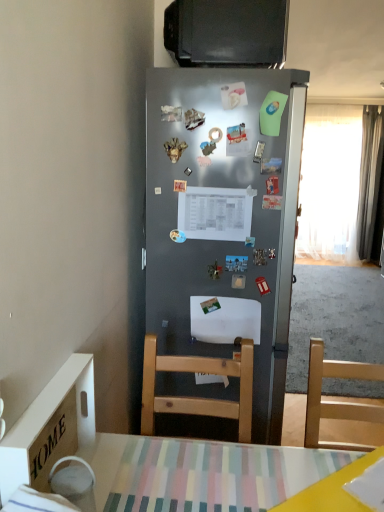
Measure the distance between satin silver fridge at center and camera.

They are 4.67 feet apart.

What is the approximate width of silky gray curtain at right, the second curtain when ordered from left to right?

It is 8.32 inches.

What is the approximate width of metallic silver magnet at center, marked as the 1th magnet in a bottom-to-top arrangement?

It is 0.44 inches.

Describe the element at coordinates (177, 236) in the screenshot. The image size is (384, 512). I see `metallic silver magnet at center, marked as the 1th magnet in a bottom-to-top arrangement` at that location.

What do you see at coordinates (233, 95) in the screenshot?
I see `white glossy coffee cup at upper center, arranged as the first magnet when viewed from the top` at bounding box center [233, 95].

This screenshot has height=512, width=384. Describe the element at coordinates (236, 134) in the screenshot. I see `metallic silver airplane at center, which is the 5th magnet from top to bottom` at that location.

At what (x,y) coordinates should I click in order to perform the action: click on metallic silver airplane at center, which is the 5th magnet from top to bottom. Please return your answer as a coordinate pair (x, y). The image size is (384, 512). Looking at the image, I should click on (236, 134).

What is the approximate width of white sheer curtain at right, acting as the first curtain starting from the left?

The width of white sheer curtain at right, acting as the first curtain starting from the left, is 7.44 inches.

Where is `satin silver fridge at center`? This screenshot has height=512, width=384. satin silver fridge at center is located at coordinates (220, 251).

Considering the relative sizes of white cardboard box at lower left and metallic silver magnet at upper center, acting as the tenth magnet starting from the bottom, in the image provided, is white cardboard box at lower left shorter than metallic silver magnet at upper center, acting as the tenth magnet starting from the bottom,?

In fact, white cardboard box at lower left may be taller than metallic silver magnet at upper center, acting as the tenth magnet starting from the bottom.

Is white cardboard box at lower left oriented towards metallic silver magnet at upper center, the 2th magnet from the top?

No, white cardboard box at lower left is not aimed at metallic silver magnet at upper center, the 2th magnet from the top.

Considering the positions of point (65, 399) and point (163, 115), is point (65, 399) closer or farther from the camera than point (163, 115)?

Point (65, 399) is positioned closer to the camera compared to point (163, 115).

Can you confirm if white cardboard box at lower left is thinner than metallic silver magnet at upper center, the 2th magnet from the top?

In fact, white cardboard box at lower left might be wider than metallic silver magnet at upper center, the 2th magnet from the top.

Which point is more forward, (271, 58) or (359, 245)?

Positioned in front is point (271, 58).

Is black glossy television at upper center taller or shorter than silky gray curtain at right, acting as the first curtain starting from the right?

Considering their sizes, black glossy television at upper center has less height than silky gray curtain at right, acting as the first curtain starting from the right.

Is black glossy television at upper center next to silky gray curtain at right, acting as the first curtain starting from the right?

black glossy television at upper center and silky gray curtain at right, acting as the first curtain starting from the right, are clearly separated.

Relative to silky gray curtain at right, acting as the first curtain starting from the right, is black glossy television at upper center in front or behind?

black glossy television at upper center is positioned closer to the viewer than silky gray curtain at right, acting as the first curtain starting from the right.

From a real-world perspective, is metallic silver magnet at upper center, the 3th magnet when ordered from bottom to top, physically below white sheer curtain at right, positioned as the second curtain in right-to-left order?

Actually, metallic silver magnet at upper center, the 3th magnet when ordered from bottom to top, is physically above white sheer curtain at right, positioned as the second curtain in right-to-left order, in the real world.

Considering the positions of point (263, 172) and point (325, 198), is point (263, 172) closer or farther from the camera than point (325, 198)?

Point (263, 172).

How many degrees apart are the facing directions of metallic silver magnet at upper center, the 3th magnet when ordered from bottom to top, and white sheer curtain at right, acting as the first curtain starting from the left?

0.982 degrees.

Considering the positions of objects metallic silver magnet at upper center, the 3th magnet when ordered from bottom to top, and white sheer curtain at right, positioned as the second curtain in right-to-left order, in the image provided, who is more to the left, metallic silver magnet at upper center, the 3th magnet when ordered from bottom to top, or white sheer curtain at right, positioned as the second curtain in right-to-left order,?

metallic silver magnet at upper center, the 3th magnet when ordered from bottom to top, is more to the left.

From a real-world perspective, is satin silver fridge at center located beneath black glossy television at upper center?

Indeed, from a real-world perspective, satin silver fridge at center is positioned beneath black glossy television at upper center.

Does satin silver fridge at center turn towards black glossy television at upper center?

No, satin silver fridge at center is not facing towards black glossy television at upper center.

Considering the sizes of objects satin silver fridge at center and black glossy television at upper center in the image provided, who is smaller, satin silver fridge at center or black glossy television at upper center?

black glossy television at upper center is smaller.

What's the angular difference between satin silver fridge at center and black glossy television at upper center's facing directions?

There is a 0.000396-degree angle between the facing directions of satin silver fridge at center and black glossy television at upper center.

Considering the relative sizes of metallic rectangular magnet at center, which appears as the 10th magnet when viewed from the top, and green matte magnet at upper right, which is the ninth magnet from bottom to top, in the image provided, is metallic rectangular magnet at center, which appears as the 10th magnet when viewed from the top, bigger than green matte magnet at upper right, which is the ninth magnet from bottom to top,?

No.

Considering the relative sizes of metallic rectangular magnet at center, acting as the 2th magnet starting from the bottom, and green matte magnet at upper right, which is the ninth magnet from bottom to top, in the image provided, is metallic rectangular magnet at center, acting as the 2th magnet starting from the bottom, taller than green matte magnet at upper right, which is the ninth magnet from bottom to top,?

No, metallic rectangular magnet at center, acting as the 2th magnet starting from the bottom, is not taller than green matte magnet at upper right, which is the ninth magnet from bottom to top.

From the picture: Is metallic rectangular magnet at center, acting as the 2th magnet starting from the bottom, looking in the opposite direction of green matte magnet at upper right, marked as the 3th magnet in a top-to-bottom arrangement?

metallic rectangular magnet at center, acting as the 2th magnet starting from the bottom, does not have its back to green matte magnet at upper right, marked as the 3th magnet in a top-to-bottom arrangement.

Is metallic rectangular magnet at center, acting as the 2th magnet starting from the bottom, positioned behind green matte magnet at upper right, which is the ninth magnet from bottom to top?

Yes.

From a real-world perspective, is white glossy coffee cup at upper center, the eleventh magnet in the bottom-to-top sequence, physically located above or below black glossy television at upper center?

Clearly, from a real-world perspective, white glossy coffee cup at upper center, the eleventh magnet in the bottom-to-top sequence, is below black glossy television at upper center.

From the image's perspective, count 1st magnets downward from the black glossy television at upper center and point to it. Please provide its 2D coordinates.

[(233, 95)]

Between point (229, 103) and point (204, 19), which one is positioned behind?

The point (229, 103) is more distant.

Considering the sizes of white glossy coffee cup at upper center, arranged as the first magnet when viewed from the top, and black glossy television at upper center in the image, is white glossy coffee cup at upper center, arranged as the first magnet when viewed from the top, taller or shorter than black glossy television at upper center?

Clearly, white glossy coffee cup at upper center, arranged as the first magnet when viewed from the top, is shorter compared to black glossy television at upper center.

Consider the image. Would you say metallic rectangular magnet at center, the eighth magnet from the top, is outside metallic rectangular magnet at center, acting as the 2th magnet starting from the bottom?

metallic rectangular magnet at center, the eighth magnet from the top, lies outside metallic rectangular magnet at center, acting as the 2th magnet starting from the bottom,'s area.

Is metallic rectangular magnet at center, which is counted as the 4th magnet, starting from the bottom, taller or shorter than metallic rectangular magnet at center, acting as the 2th magnet starting from the bottom?

metallic rectangular magnet at center, which is counted as the 4th magnet, starting from the bottom, is taller than metallic rectangular magnet at center, acting as the 2th magnet starting from the bottom.

Between point (256, 149) and point (272, 186), which one is positioned in front?

The point (256, 149) is closer to the camera.

Where is `box beneath the metallic silver magnet at upper center, acting as the tenth magnet starting from the bottom (from a real-world perspective)`? The height and width of the screenshot is (512, 384). box beneath the metallic silver magnet at upper center, acting as the tenth magnet starting from the bottom (from a real-world perspective) is located at coordinates (50, 426).

In the image, there is a silky gray curtain at right, acting as the first curtain starting from the right. Identify the location of television below it (from the image's perspective). This screenshot has width=384, height=512. (227, 33).

Which object lies nearer to the anchor point white sheer curtain at right, positioned as the second curtain in right-to-left order, metallic rectangular magnet at center, the eighth magnet from the top, or green matte magnet at upper right, marked as the 3th magnet in a top-to-bottom arrangement?

The object closer to white sheer curtain at right, positioned as the second curtain in right-to-left order, is green matte magnet at upper right, marked as the 3th magnet in a top-to-bottom arrangement.

From the picture: Estimate the real-world distances between objects in this image. Which object is further from metallic silver magnet at center, positioned as the eighth magnet in bottom-to-top order, metallic silver magnet at upper center, which appears as the 9th magnet when viewed from the top, or white sheer curtain at right, positioned as the second curtain in right-to-left order?

white sheer curtain at right, positioned as the second curtain in right-to-left order, lies further to metallic silver magnet at center, positioned as the eighth magnet in bottom-to-top order, than the other object.

Looking at the image, which one is located closer to black glossy television at upper center, white sheer curtain at right, positioned as the second curtain in right-to-left order, or gold metallic crown at center, marked as the fifth magnet in a bottom-to-top arrangement?

gold metallic crown at center, marked as the fifth magnet in a bottom-to-top arrangement.

Which object lies further to the anchor point metallic silver magnet at center, the 4th magnet in the top-to-bottom sequence, gold metallic crown at center, marked as the fifth magnet in a bottom-to-top arrangement, or black glossy television at upper center?

black glossy television at upper center is positioned further to the anchor metallic silver magnet at center, the 4th magnet in the top-to-bottom sequence.

Looking at the image, which one is located closer to metallic silver magnet at center, the 4th magnet in the top-to-bottom sequence, metallic rectangular magnet at center, the eighth magnet from the top, or metallic silver magnet at upper center, acting as the tenth magnet starting from the bottom?

Among the two, metallic silver magnet at upper center, acting as the tenth magnet starting from the bottom, is located nearer to metallic silver magnet at center, the 4th magnet in the top-to-bottom sequence.

Estimate the real-world distances between objects in this image. Which object is further from gold metallic crown at center, placed as the 7th magnet when sorted from top to bottom, metallic ring at center, the sixth magnet viewed from the top, or white glossy coffee cup at upper center, arranged as the first magnet when viewed from the top?

white glossy coffee cup at upper center, arranged as the first magnet when viewed from the top, is positioned further to the anchor gold metallic crown at center, placed as the 7th magnet when sorted from top to bottom.

Based on the photo, which object lies further to the anchor point black glossy television at upper center, metallic rectangular magnet at center, acting as the 2th magnet starting from the bottom, or white cardboard box at lower left?

The object further to black glossy television at upper center is white cardboard box at lower left.

Considering their positions, is white sheer curtain at right, positioned as the second curtain in right-to-left order, positioned closer to green matte magnet at upper right, which is the ninth magnet from bottom to top, than white glossy coffee cup at upper center, the eleventh magnet in the bottom-to-top sequence?

Based on the image, white glossy coffee cup at upper center, the eleventh magnet in the bottom-to-top sequence, appears to be nearer to green matte magnet at upper right, which is the ninth magnet from bottom to top.

Find the location of `box between metallic silver magnet at upper center, acting as the tenth magnet starting from the bottom, and light wood chair at lower right, in the vertical direction`. box between metallic silver magnet at upper center, acting as the tenth magnet starting from the bottom, and light wood chair at lower right, in the vertical direction is located at coordinates (50, 426).

Where is `refrigerator between white glossy coffee cup at upper center, arranged as the first magnet when viewed from the top, and white cardboard box at lower left, in the vertical direction`? refrigerator between white glossy coffee cup at upper center, arranged as the first magnet when viewed from the top, and white cardboard box at lower left, in the vertical direction is located at coordinates (220, 251).

Image resolution: width=384 pixels, height=512 pixels. What are the coordinates of `refrigerator between green matte magnet at upper right, which is the ninth magnet from bottom to top, and white cardboard box at lower left vertically` in the screenshot? It's located at (220, 251).

You are a GUI agent. You are given a task and a screenshot of the screen. Output one action in this format:
    pyautogui.click(x=<x>, y=<y>)
    Task: Click on the refrigerator located between light wood chair at lower right and metallic silver magnet at center, marked as the 1th magnet in a bottom-to-top arrangement, in the depth direction
    Image resolution: width=384 pixels, height=512 pixels.
    Given the screenshot: What is the action you would take?
    pyautogui.click(x=220, y=251)